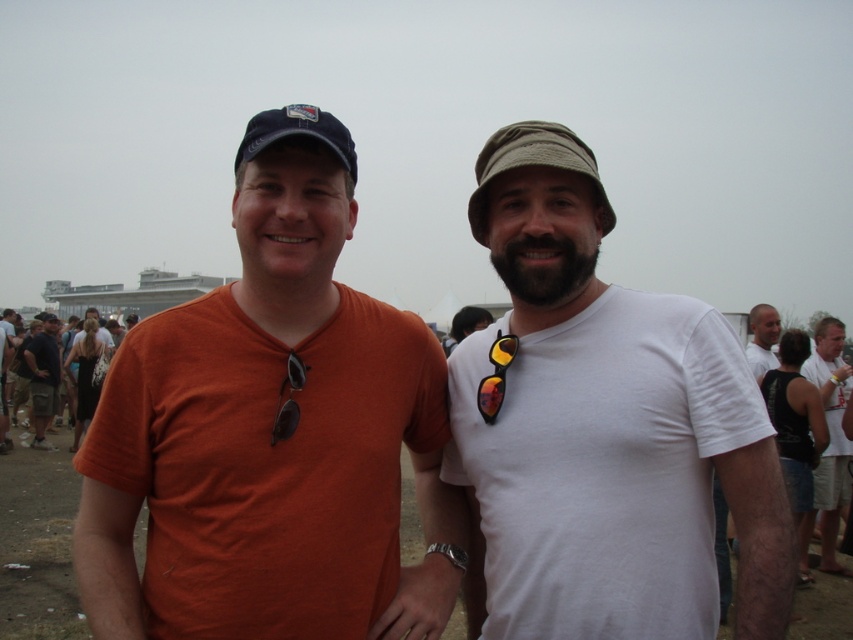
Question: Which point appears closest to the camera in this image?

Choices:
 (A) (347, 605)
 (B) (289, 435)

Answer: (A)

Question: Is khaki fabric hat at center further to the viewer compared to reflective plastic sunglasses at center?

Choices:
 (A) yes
 (B) no

Answer: (B)

Question: Can you confirm if orange cotton t-shirt at left is positioned above navy blue fabric cap at upper center?

Choices:
 (A) yes
 (B) no

Answer: (B)

Question: Estimate the real-world distances between objects in this image. Which object is farther from the black cotton t-shirt at right?

Choices:
 (A) reflective plastic sunglasses at center
 (B) black reflective sunglasses at center

Answer: (B)

Question: Does white matte t-shirt at right have a lesser width compared to khaki fabric hat at center?

Choices:
 (A) no
 (B) yes

Answer: (A)

Question: Estimate the real-world distances between objects in this image. Which object is farther from the orange cotton t-shirt at left?

Choices:
 (A) reflective plastic sunglasses at center
 (B) khaki fabric hat at center
 (C) white matte t-shirt at right

Answer: (B)